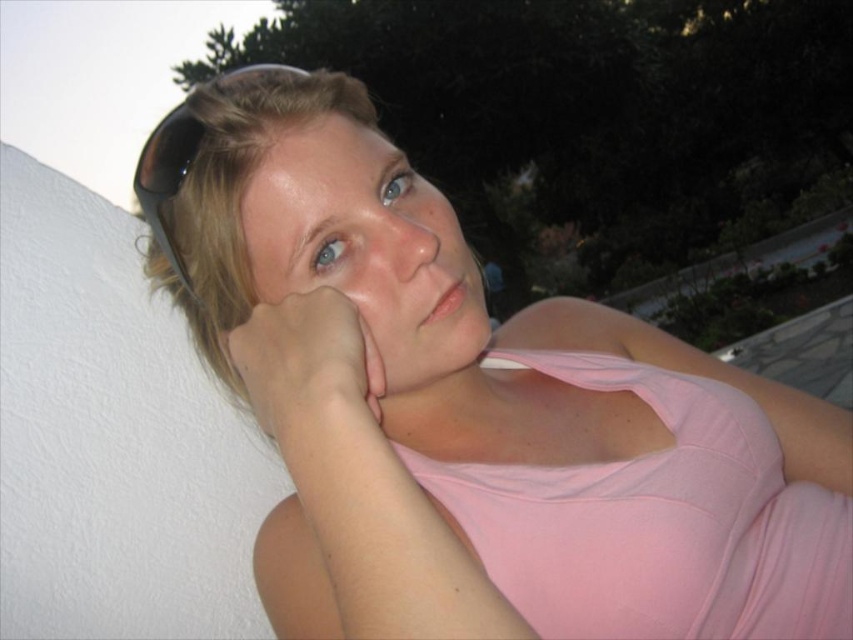
Does point (350, 308) come farther from viewer compared to point (277, 67)?

No.

Does pink matte hand at center appear under black rubber goggles at upper left?

Yes.

Between point (302, 394) and point (177, 115), which one is positioned in front?

Point (302, 394)

Locate an element on the screen. pink matte hand at center is located at coordinates (310, 371).